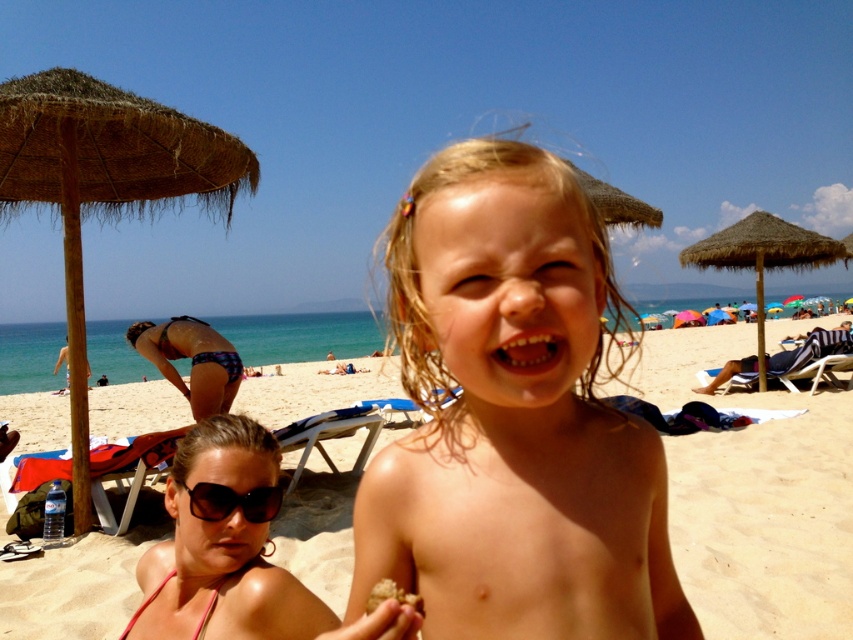
Question: Which object is positioned farthest from the blonde hair at center?

Choices:
 (A) beige sand at center
 (B) brown straw umbrella at upper left

Answer: (A)

Question: Among these points, which one is farthest from the camera?

Choices:
 (A) (78, 156)
 (B) (749, 426)
 (C) (500, 196)
 (D) (238, 506)

Answer: (B)

Question: Is thatched straw umbrella at upper right smaller than black plastic sunglasses at lower center?

Choices:
 (A) no
 (B) yes

Answer: (A)

Question: Is blonde hair at center above thatched straw umbrella at upper right?

Choices:
 (A) yes
 (B) no

Answer: (B)

Question: From the image, what is the correct spatial relationship of thatched straw umbrella at upper right in relation to plaid bikini bottom at lower left?

Choices:
 (A) above
 (B) below

Answer: (A)

Question: Which object is farther from the camera taking this photo?

Choices:
 (A) shiny skin at center
 (B) plaid bikini bottom at lower left
 (C) brown crumbly food at center
 (D) beige sand at center

Answer: (B)